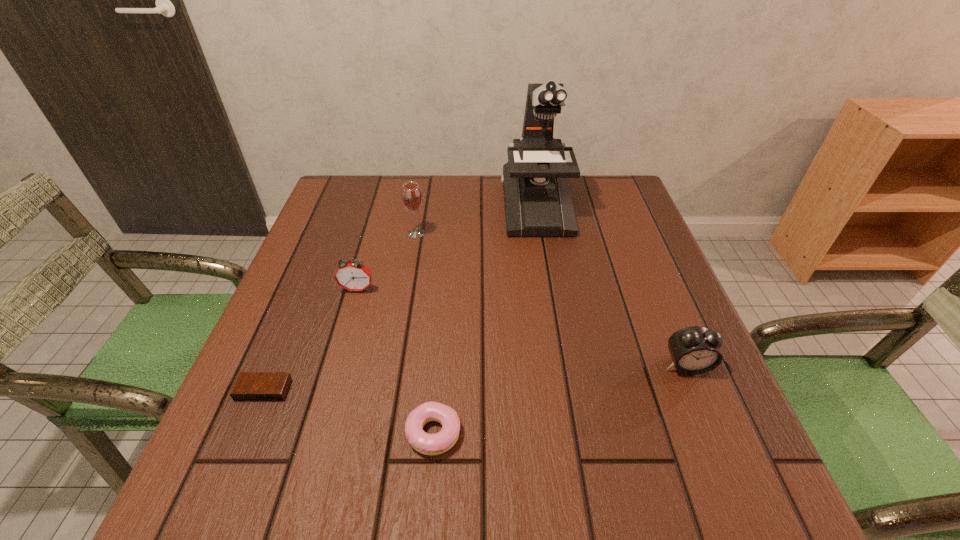
Locate an element on the screen. microscope is located at coordinates [x=537, y=198].

Identify the location of the tallest object. (537, 198).

Find the location of a particular element. wineglass is located at coordinates (412, 199).

Where is `the second tallest object`? the second tallest object is located at coordinates (412, 199).

Where is `the third nearest object`? the third nearest object is located at coordinates (695, 350).

Locate an element on the screen. This screenshot has width=960, height=540. the second farthest alarm clock is located at coordinates (695, 350).

This screenshot has height=540, width=960. In order to click on the farthest alarm clock in this screenshot , I will do pos(351,275).

The width and height of the screenshot is (960, 540). I want to click on the fifth object from right to left, so [x=351, y=275].

Locate an element on the screen. The height and width of the screenshot is (540, 960). the fourth object from left to right is located at coordinates (428, 444).

The width and height of the screenshot is (960, 540). Find the location of `the fifth tallest object`. the fifth tallest object is located at coordinates (428, 444).